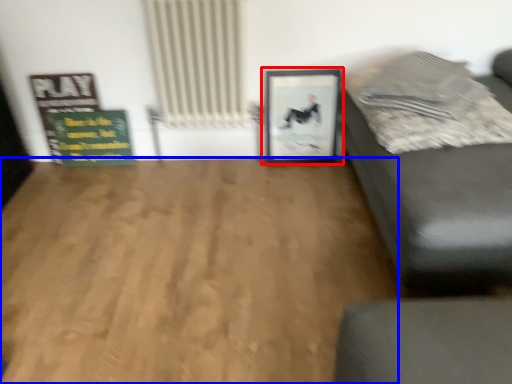
Question: Among these objects, which one is farthest to the camera, picture frame (highlighted by a red box) or hardwood (highlighted by a blue box)?

Choices:
 (A) picture frame
 (B) hardwood

Answer: (A)